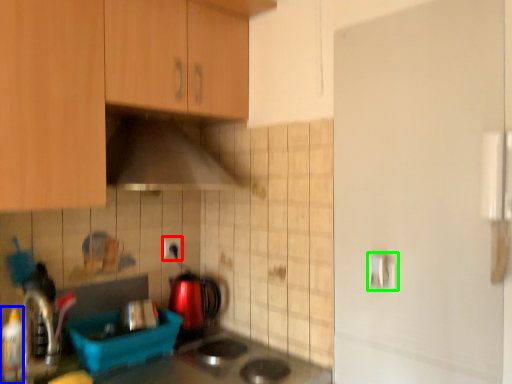
Question: Based on their relative distances, which object is farther from electric outlet (highlighted by a red box)? Choose from bottle (highlighted by a blue box) and door handle (highlighted by a green box).

Choices:
 (A) bottle
 (B) door handle

Answer: (B)